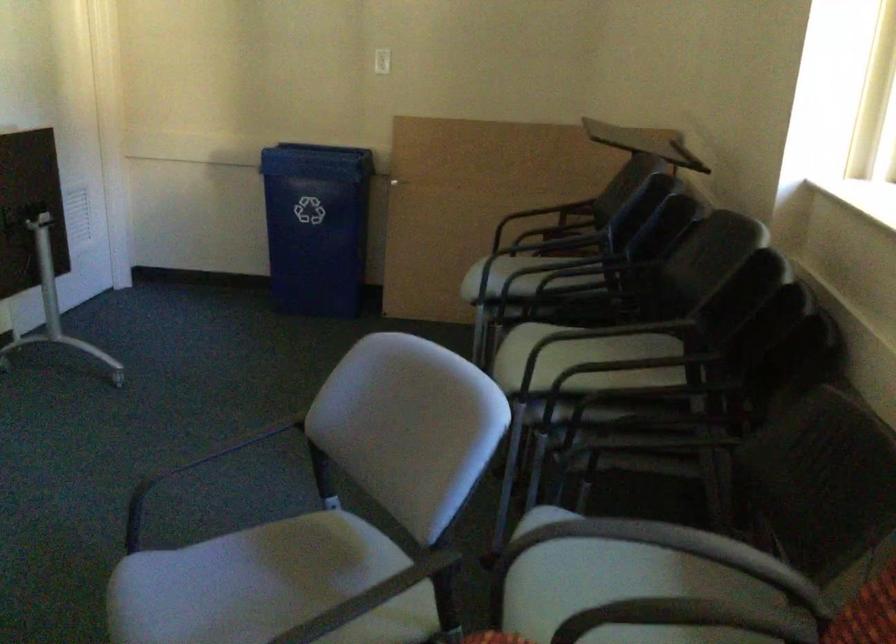
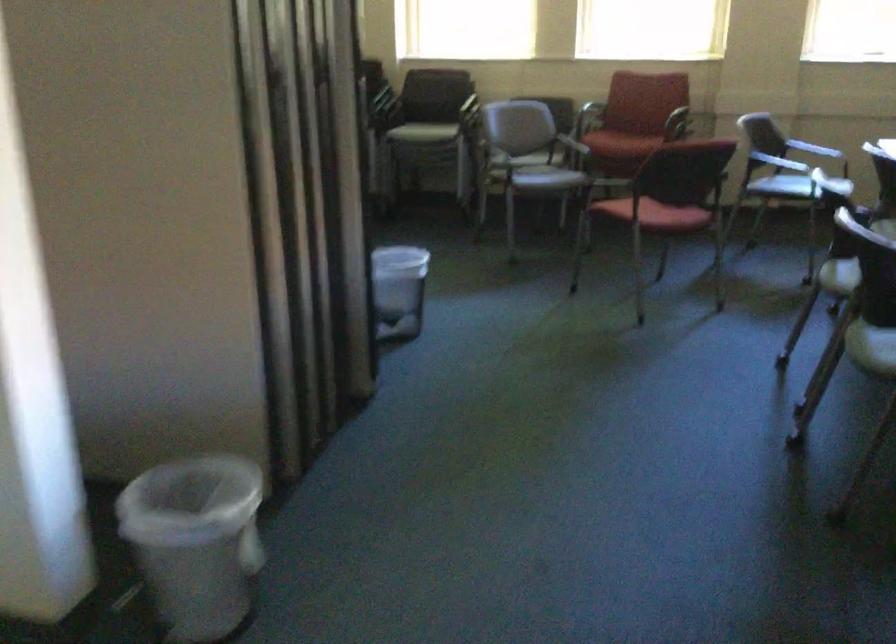
Question: I am providing you with two images of the same scene from different viewpoints. Please identify which objects are invisible in image2.

Choices:
 (A) red chair armrest
 (B) patterned sofa cushion
 (C) red chair sitting surface
 (D) blue recycling bin

Answer: (D)